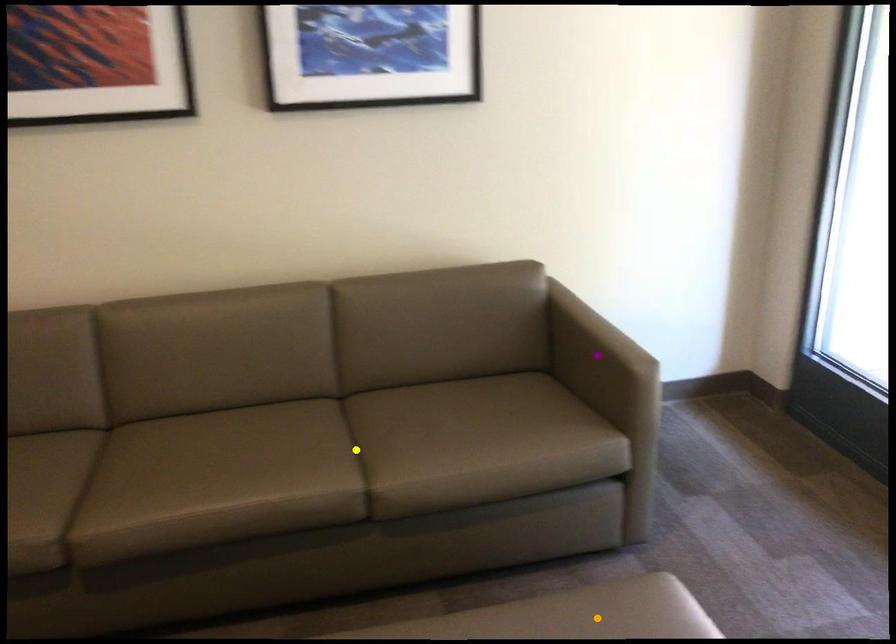
Order these from farthest to nearest:
1. purple point
2. orange point
3. yellow point

purple point
yellow point
orange point